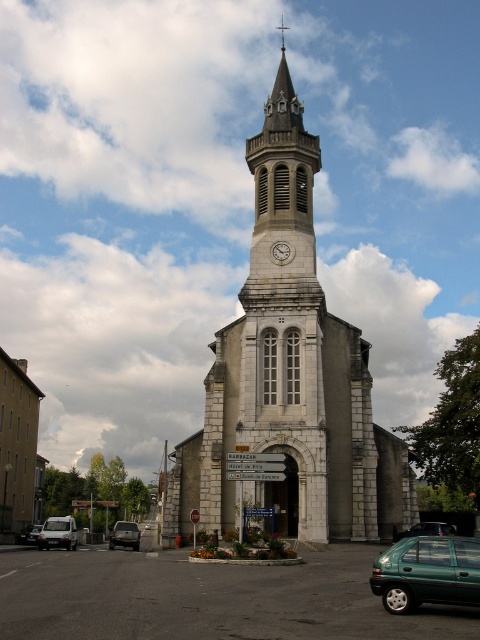
Is white stone clock tower at center shorter than white stone clock at center?

No, white stone clock tower at center is not shorter than white stone clock at center.

Who is positioned more to the left, white stone clock tower at center or white stone clock at center?

white stone clock at center is more to the left.

Does point (308, 163) come closer to viewer compared to point (291, 256)?

No, it is not.

Locate an element on the screen. white stone clock tower at center is located at coordinates (288, 380).

Which is more to the right, white stone clock tower at center or matte black van at lower left?

From the viewer's perspective, white stone clock tower at center appears more on the right side.

Does white stone clock tower at center have a smaller size compared to matte black van at lower left?

Incorrect, white stone clock tower at center is not smaller in size than matte black van at lower left.

Does point (232, 493) come behind point (23, 529)?

That is False.

The image size is (480, 640). I want to click on white stone clock tower at center, so click(x=288, y=380).

Does white matte van at lower left appear on the right side of green matte car at center?

In fact, white matte van at lower left is to the left of green matte car at center.

This screenshot has width=480, height=640. What do you see at coordinates (58, 532) in the screenshot?
I see `white matte van at lower left` at bounding box center [58, 532].

Locate an element on the screen. Image resolution: width=480 pixels, height=640 pixels. white matte van at lower left is located at coordinates (58, 532).